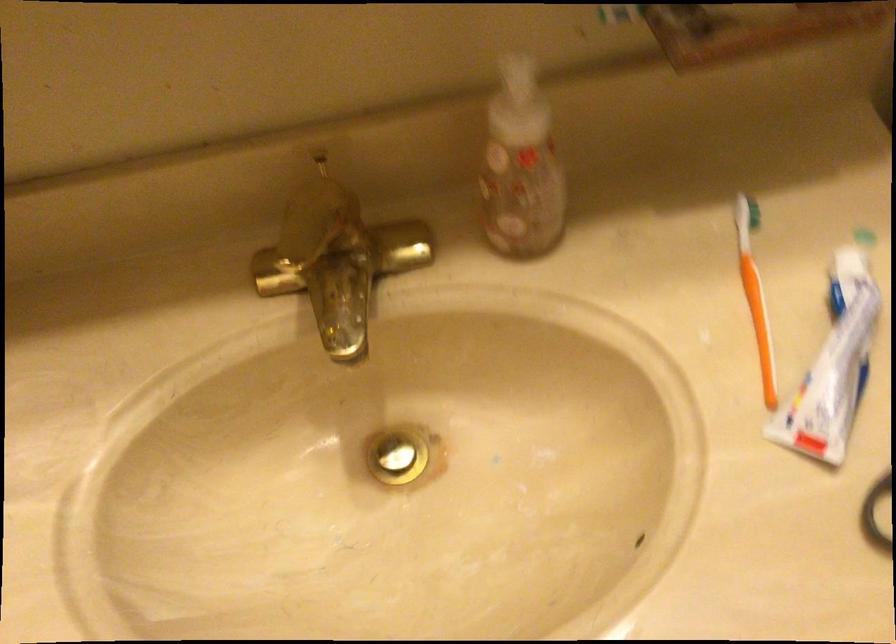
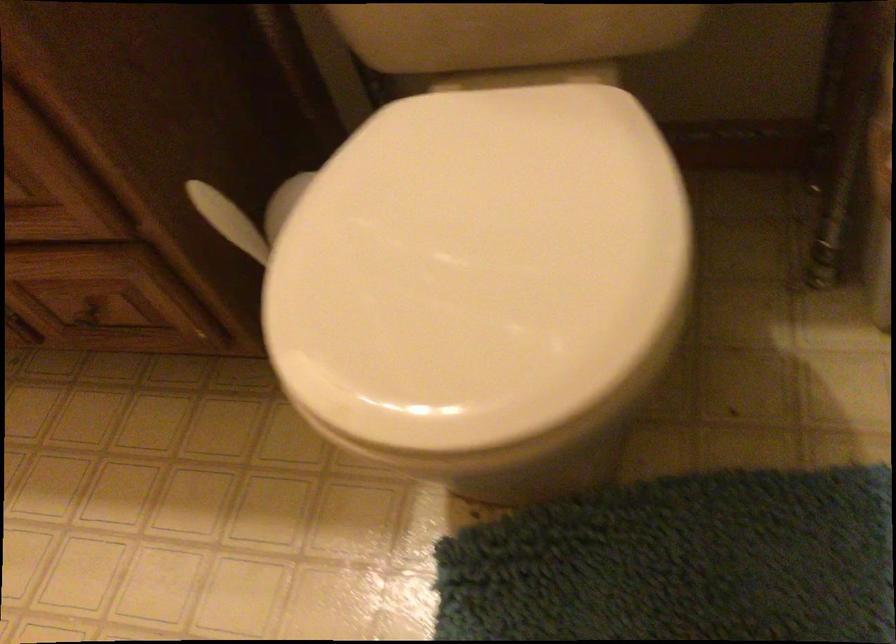
Question: In a continuous first-person perspective shot, in which direction is the camera moving?

Choices:
 (A) Left
 (B) Right
 (C) Forward
 (D) Backward

Answer: (B)